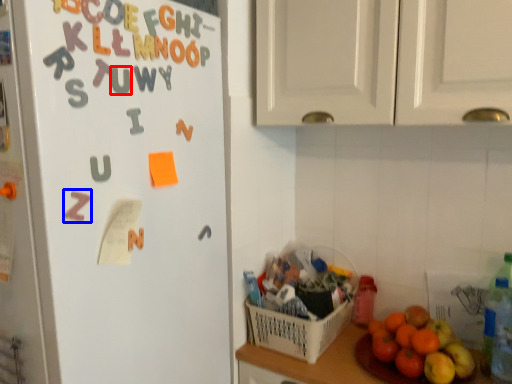
Question: Which of the following is the farthest to the observer, alphabet (highlighted by a red box) or alphabet (highlighted by a blue box)?

Choices:
 (A) alphabet
 (B) alphabet

Answer: (A)